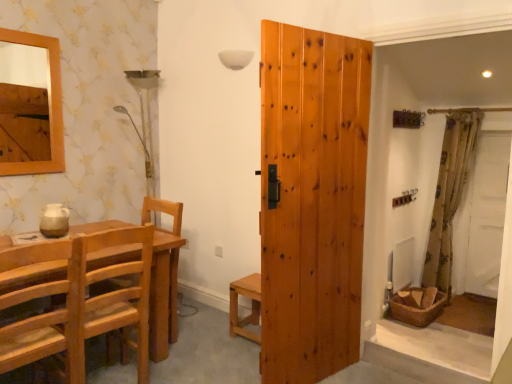
The width and height of the screenshot is (512, 384). Find the location of `free location to the left of natural wood door at center`. free location to the left of natural wood door at center is located at coordinates (226, 359).